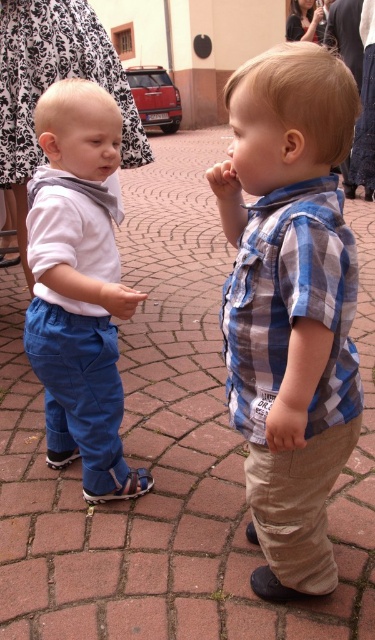
Question: Based on their relative distances, which object is farther from the brown leather sandal at lower left?

Choices:
 (A) blue plaid shirt at center
 (B) matte blue pants at lower left
 (C) matte blue pants at left

Answer: (A)

Question: Which point is closer to the camera?

Choices:
 (A) (94, 500)
 (B) (121, 307)

Answer: (B)

Question: Is matte blue pants at lower left above brown leather sandal at lower left?

Choices:
 (A) no
 (B) yes

Answer: (B)

Question: Considering the relative positions of matte blue pants at left and matte blue pants at lower left in the image provided, where is matte blue pants at left located with respect to matte blue pants at lower left?

Choices:
 (A) right
 (B) left

Answer: (B)

Question: Observing the image, what is the correct spatial positioning of tan/knitwear hand at lower center in reference to matte blue pants at lower left?

Choices:
 (A) left
 (B) right

Answer: (B)

Question: Which point is farther from the camera taking this photo?

Choices:
 (A) (90, 502)
 (B) (267, 493)
 (C) (72, 308)

Answer: (A)